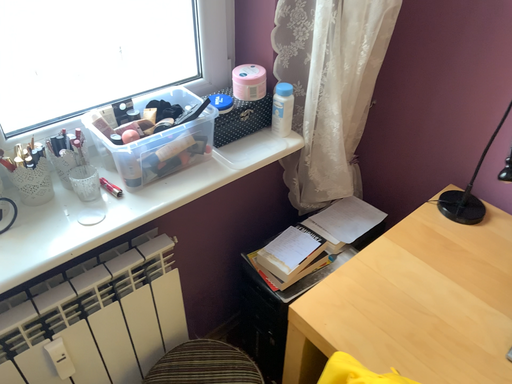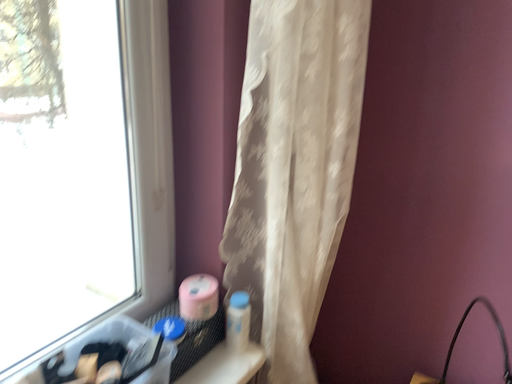
Question: Which way did the camera rotate in the video?

Choices:
 (A) rotated downward
 (B) rotated upward

Answer: (B)